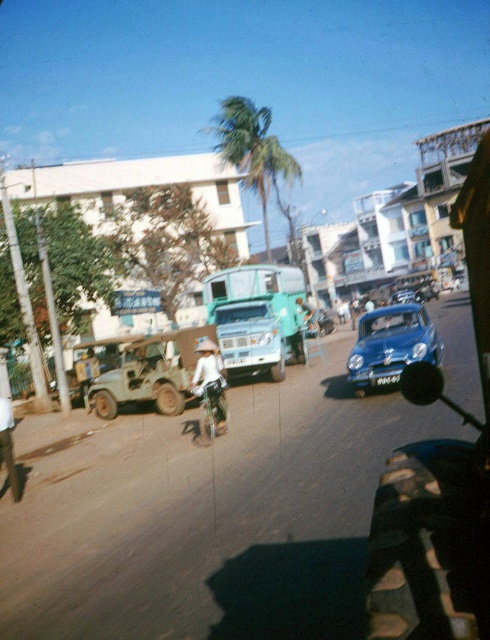
Question: Observing the image, what is the correct spatial positioning of teal matte truck at center in reference to white fabric hat at center?

Choices:
 (A) right
 (B) left

Answer: (A)

Question: Which point is farther to the camera?

Choices:
 (A) (294, 250)
 (B) (169, 408)
 (C) (377, 358)

Answer: (A)

Question: Is teal matte truck at center in front of light green matte jeep at left?

Choices:
 (A) no
 (B) yes

Answer: (A)

Question: Can you confirm if light green matte jeep at left is thinner than green leafy palm tree at center?

Choices:
 (A) no
 (B) yes

Answer: (B)

Question: Based on their relative distances, which object is nearer to the teal matte truck at center?

Choices:
 (A) white fabric hat at center
 (B) shiny blue car at center

Answer: (B)

Question: Which point is farther from the camera taking this photo?

Choices:
 (A) (394, 369)
 (B) (224, 282)
 (C) (184, 381)

Answer: (B)